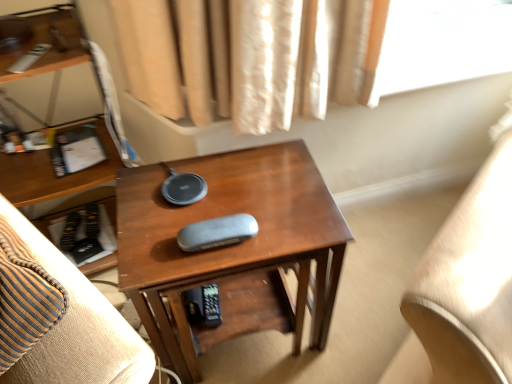
Question: Considering their positions, is wooden side table at center located in front of or behind shiny brown desk at center?

Choices:
 (A) front
 (B) behind

Answer: (A)

Question: Is wooden side table at center inside or outside of shiny brown desk at center?

Choices:
 (A) inside
 (B) outside

Answer: (B)

Question: From the image's perspective, is wooden side table at center located above or below shiny brown desk at center?

Choices:
 (A) below
 (B) above

Answer: (B)

Question: Is shiny brown desk at center situated inside wooden side table at center or outside?

Choices:
 (A) outside
 (B) inside

Answer: (A)

Question: Considering their positions, is shiny brown desk at center located in front of or behind wooden side table at center?

Choices:
 (A) behind
 (B) front

Answer: (A)

Question: From the image's perspective, is shiny brown desk at center above or below wooden side table at center?

Choices:
 (A) below
 (B) above

Answer: (A)

Question: Is shiny brown desk at center wider or thinner than wooden side table at center?

Choices:
 (A) thin
 (B) wide

Answer: (A)